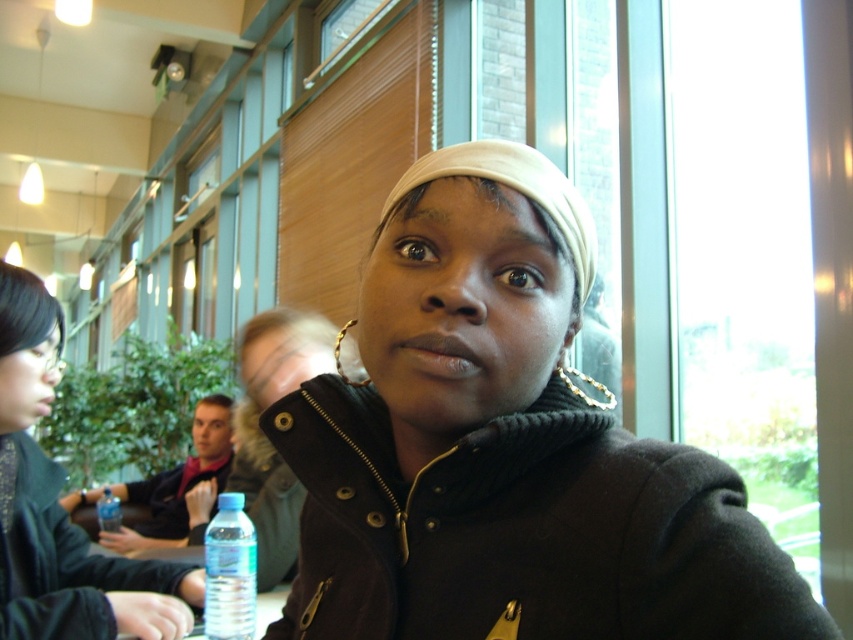
Who is taller, matte black jacket at upper left or transparent plastic bottle at lower center?

matte black jacket at upper left

Does matte black jacket at upper left have a larger size compared to transparent plastic bottle at lower center?

Correct, matte black jacket at upper left is larger in size than transparent plastic bottle at lower center.

Between point (73, 525) and point (223, 589), which one is positioned behind?

The point (73, 525) is more distant.

I want to click on matte black jacket at upper left, so click(x=61, y=508).

Between point (186, 593) and point (111, 518), which one is positioned in front?

Point (186, 593)

Can you confirm if matte black jacket at upper left is positioned to the right of transparent plastic bottle at lower left?

Correct, you'll find matte black jacket at upper left to the right of transparent plastic bottle at lower left.

Is point (13, 548) less distant than point (107, 484)?

That is True.

I want to click on matte black jacket at upper left, so click(61, 508).

Is black woolen coat at center smaller than transparent plastic bottle at lower center?

A: Actually, black woolen coat at center might be larger than transparent plastic bottle at lower center.

Is black woolen coat at center thinner than transparent plastic bottle at lower center?

No, black woolen coat at center is not thinner than transparent plastic bottle at lower center.

Locate an element on the screen. The height and width of the screenshot is (640, 853). black woolen coat at center is located at coordinates (505, 449).

What are the coordinates of `black woolen coat at center` in the screenshot? It's located at (505, 449).